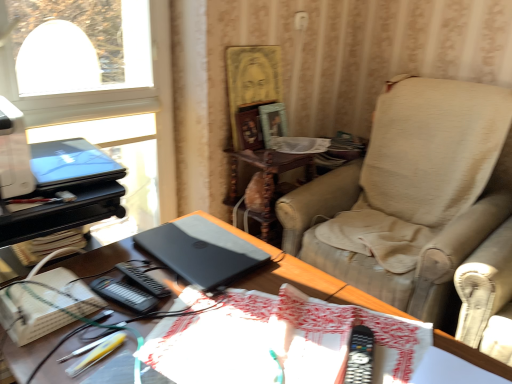
Identify the location of vacant area on top of matte black laptop at center, marked as the second laptop in a left-to-right arrangement (from a real-world perspective). (187, 235).